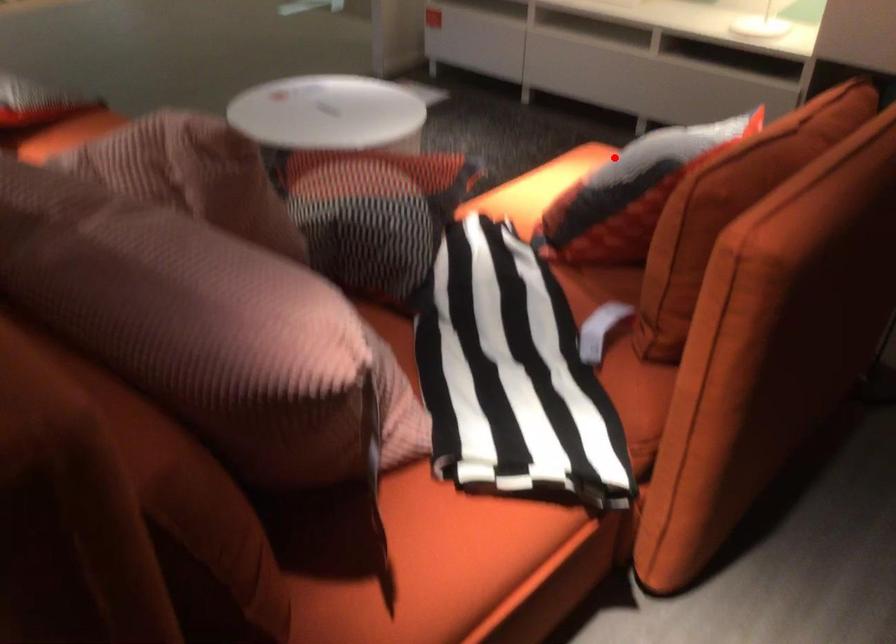
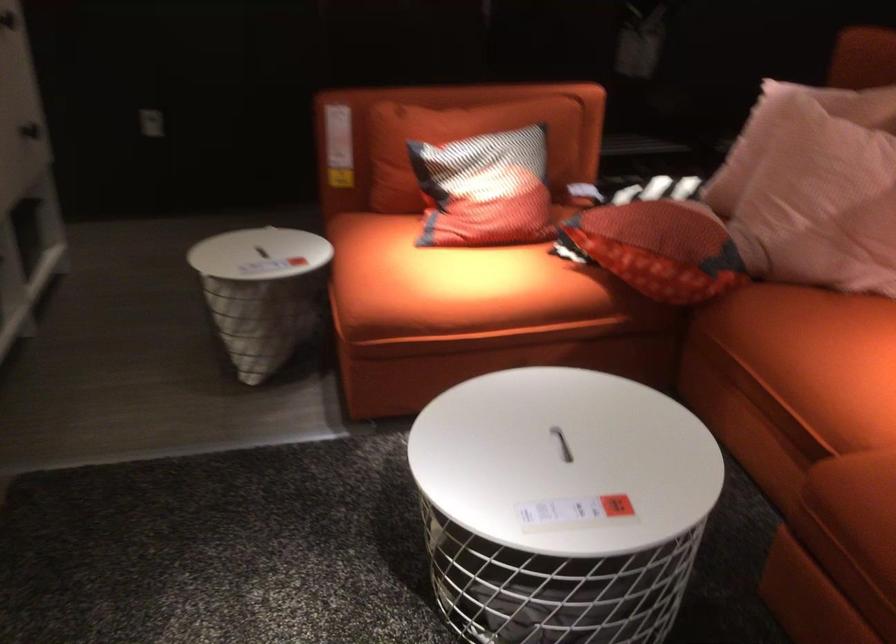
The point at the highlighted location is marked in the first image. Where is the corresponding point in the second image?

(485, 190)